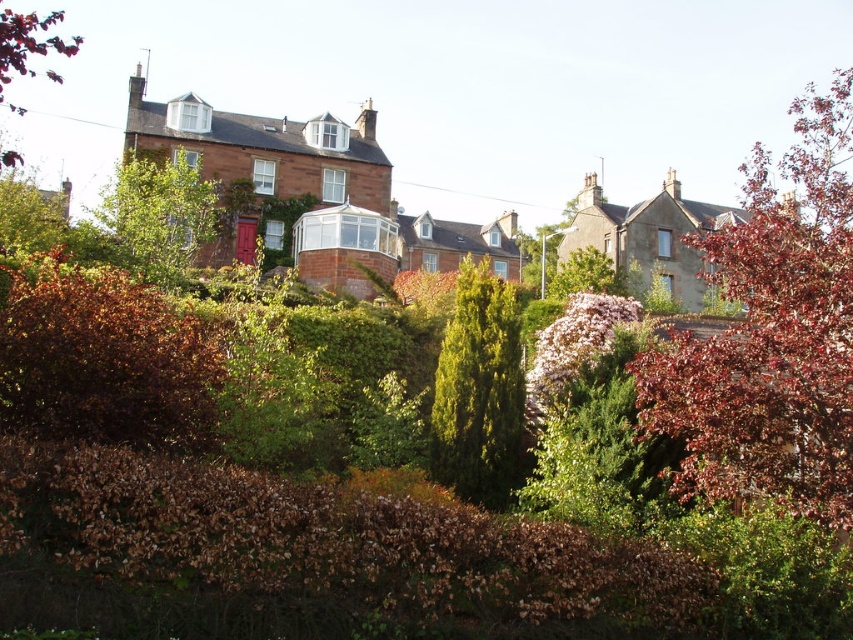
Which of these two, dark red leafy tree at upper right or green leafy tree at center, stands taller?

dark red leafy tree at upper right

Is point (793, 408) positioned before point (129, 164)?

That is True.

Measure the distance between dark red leafy tree at upper right and camera.

dark red leafy tree at upper right is 92.06 feet away from camera.

The height and width of the screenshot is (640, 853). Identify the location of dark red leafy tree at upper right. (772, 333).

Between green leafy tree at center and smooth brown tree at upper left, which one is positioned higher?

Positioned higher is smooth brown tree at upper left.

Between green leafy tree at center and smooth brown tree at upper left, which one is positioned lower?

green leafy tree at center is lower down.

Does point (129, 196) come behind point (0, 10)?

No, it is not.

Identify the location of green leafy tree at center. The width and height of the screenshot is (853, 640). (160, 214).

Does point (666, 385) lie behind point (505, 458)?

No, (666, 385) is closer to viewer.

Does dark red leafy tree at upper right come in front of green textured tree at center?

Yes, dark red leafy tree at upper right is in front of green textured tree at center.

Who is more distant from viewer, (642, 417) or (437, 385)?

Point (437, 385)

You are a GUI agent. You are given a task and a screenshot of the screen. Output one action in this format:
    pyautogui.click(x=<x>, y=<y>)
    Task: Click on the dark red leafy tree at upper right
    The image size is (853, 640).
    Given the screenshot: What is the action you would take?
    pyautogui.click(x=772, y=333)